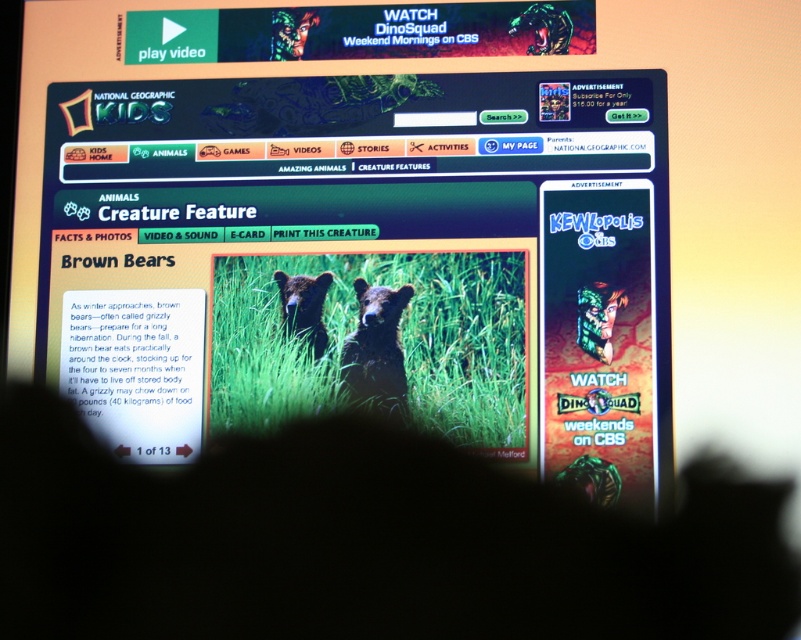
Who is positioned more to the right, brown furry bear at center or soft brown fur bear at center?

Positioned to the right is brown furry bear at center.

Can you confirm if brown furry bear at center is positioned above soft brown fur bear at center?

No.

Find the location of a particular element. brown furry bear at center is located at coordinates (376, 349).

At what (x,y) coordinates should I click in order to perform the action: click on brown furry bear at center. Please return your answer as a coordinate pair (x, y). The height and width of the screenshot is (640, 801). Looking at the image, I should click on (376, 349).

Based on the photo, can you confirm if green grass at center is positioned to the right of brown furry bear at center?

Incorrect, green grass at center is not on the right side of brown furry bear at center.

Does green grass at center appear under brown furry bear at center?

No, green grass at center is not below brown furry bear at center.

Who is more distant from viewer, (252, 262) or (379, 307)?

The point (252, 262) is more distant.

Where is `green grass at center`? This screenshot has height=640, width=801. green grass at center is located at coordinates (369, 328).

Which is above, green grass at center or soft brown fur bear at center?

soft brown fur bear at center is higher up.

In the scene shown: Does green grass at center have a greater height compared to soft brown fur bear at center?

Yes.

Is point (521, 273) less distant than point (300, 300)?

Yes, it is in front of point (300, 300).

This screenshot has height=640, width=801. Find the location of `green grass at center`. green grass at center is located at coordinates (369, 328).